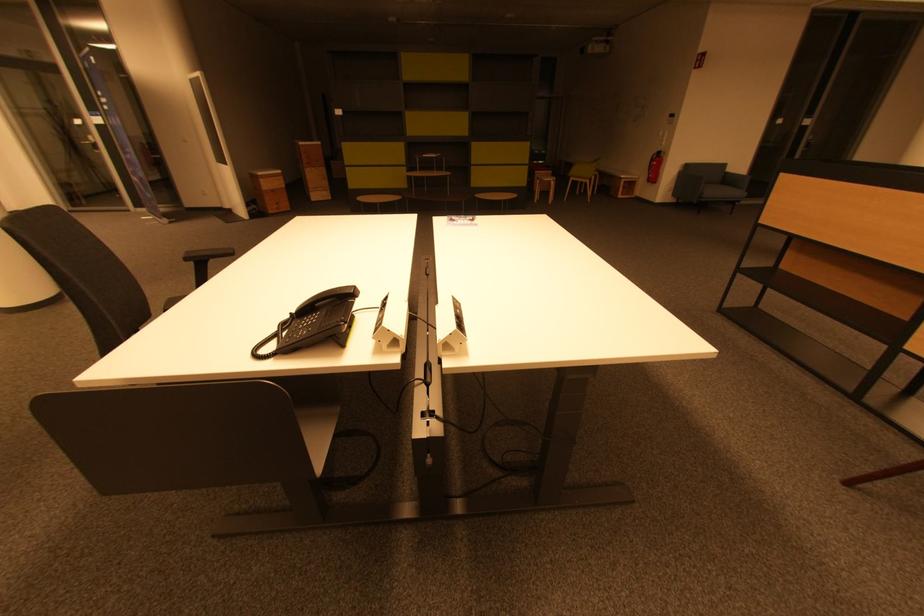
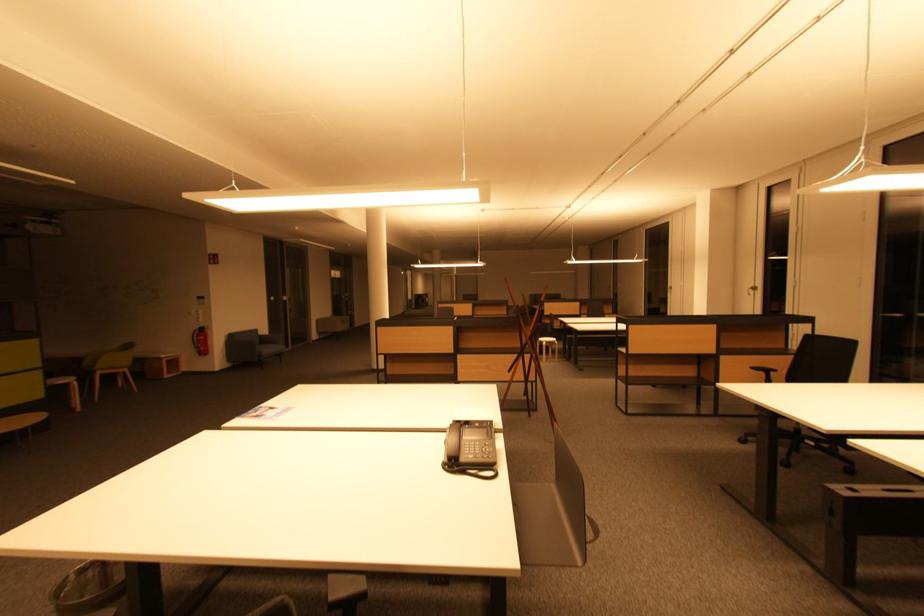
Find the pixel in the second image that matches pixel 719 195 in the first image.

(272, 352)